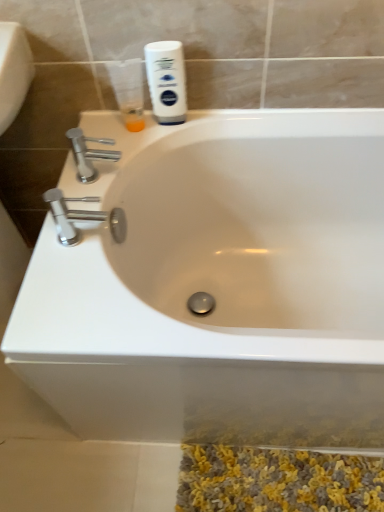
Where is `free space between white matte shaving cream at upper center and polished chrome faucet at upper left, the second tap when ordered from bottom to top`? The width and height of the screenshot is (384, 512). free space between white matte shaving cream at upper center and polished chrome faucet at upper left, the second tap when ordered from bottom to top is located at coordinates (139, 144).